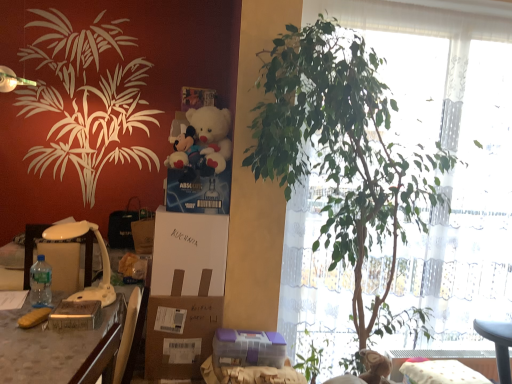
Identify the location of blank space situated above metallic gold box at lower left, which ranks as the 1th gift in top-to-bottom order (from a real-world perspective). (78, 306).